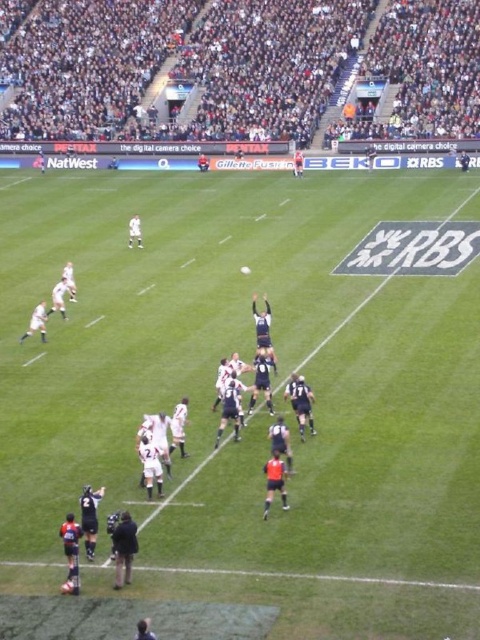
Question: Which object appears closest to the camera in this image?

Choices:
 (A) black matte referee at lower left
 (B) green grass field at center
 (C) black jersey at lower left
 (D) dark gray stadium seats at upper center

Answer: (B)

Question: Is dark gray stadium seats at upper center above black matte referee at lower left?

Choices:
 (A) yes
 (B) no

Answer: (A)

Question: Which of the following is the closest to the observer?

Choices:
 (A) (131, 568)
 (B) (327, 376)
 (C) (68, 99)

Answer: (A)

Question: Can you confirm if black matte referee at lower left is thinner than black jersey at lower left?

Choices:
 (A) yes
 (B) no

Answer: (B)

Question: Which of the following is the farthest from the observer?

Choices:
 (A) black matte referee at lower left
 (B) green grass field at center
 (C) dark gray stadium seats at upper center

Answer: (C)

Question: Is black matte referee at lower left to the left of black jersey at lower left from the viewer's perspective?

Choices:
 (A) yes
 (B) no

Answer: (B)